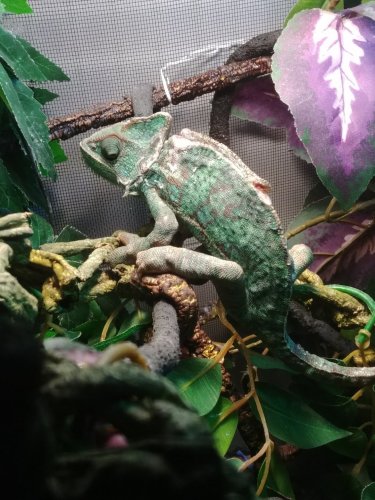
Find the location of `surface`. surface is located at coordinates (200, 192).